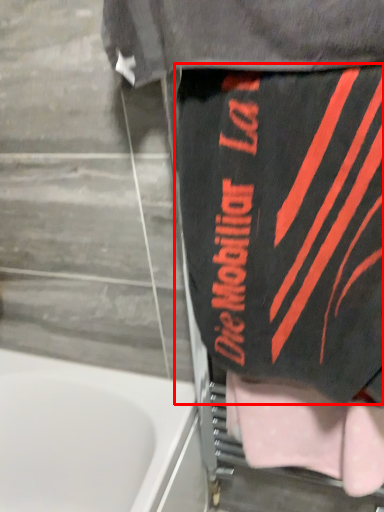
Question: Considering the relative positions of underclothes (annotated by the red box) and towel in the image provided, where is underclothes (annotated by the red box) located with respect to the staircase?

Choices:
 (A) right
 (B) left

Answer: (B)